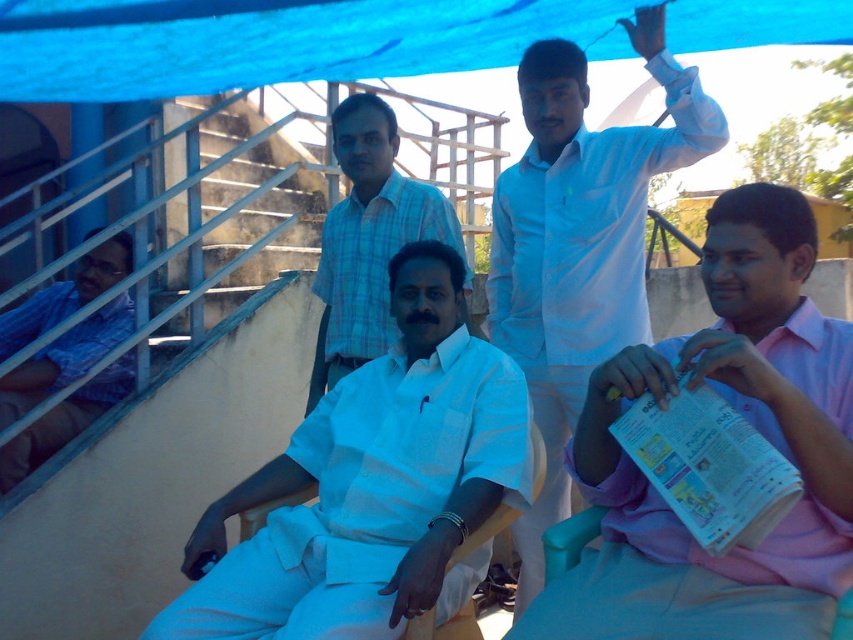
Question: Which point is closer to the camera taking this photo?

Choices:
 (A) click(x=585, y=362)
 (B) click(x=210, y=524)
 (C) click(x=93, y=339)

Answer: (B)

Question: Does white cotton kurta at center appear over blue plaid shirt at left?

Choices:
 (A) no
 (B) yes

Answer: (A)

Question: Which object is farther from the camera taking this photo?

Choices:
 (A) white cotton kurta at center
 (B) white glossy shirt at upper center
 (C) pink cotton shirt at lower right
 (D) white cotton shirt at center

Answer: (D)

Question: Can you confirm if pink cotton shirt at lower right is positioned above white cotton kurta at center?

Choices:
 (A) no
 (B) yes

Answer: (B)

Question: Which point is closer to the camera?

Choices:
 (A) white glossy shirt at upper center
 (B) metallic gray staircase at upper left

Answer: (A)

Question: Can you confirm if white glossy shirt at upper center is smaller than white cotton shirt at center?

Choices:
 (A) yes
 (B) no

Answer: (B)